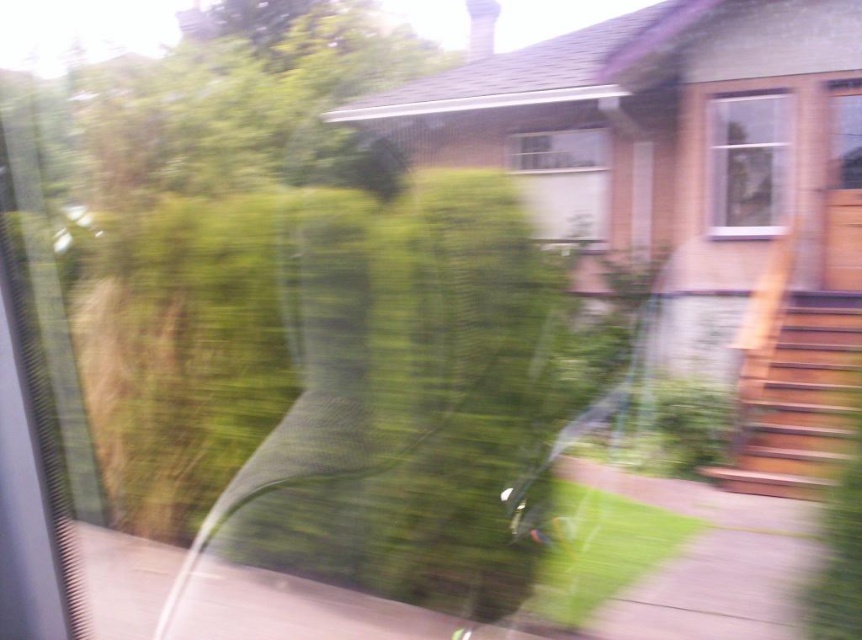
Who is shorter, transparent plastic screen door at upper right or clear glass window at center?

clear glass window at center

Is transparent plastic screen door at upper right thinner than clear glass window at center?

Correct, transparent plastic screen door at upper right's width is less than clear glass window at center's.

Locate an element on the screen. The image size is (862, 640). transparent plastic screen door at upper right is located at coordinates (842, 193).

Can you confirm if white glass window at upper right is smaller than transparent plastic screen door at upper right?

No.

This screenshot has height=640, width=862. What do you see at coordinates (748, 163) in the screenshot?
I see `white glass window at upper right` at bounding box center [748, 163].

Is point (717, 173) farther from camera compared to point (840, 218)?

Yes, it is behind point (840, 218).

Locate an element on the screen. Image resolution: width=862 pixels, height=640 pixels. white glass window at upper right is located at coordinates (748, 163).

Is white glass window at upper right positioned at the back of clear glass window at center?

No, it is not.

What are the coordinates of `white glass window at upper right` in the screenshot? It's located at (748, 163).